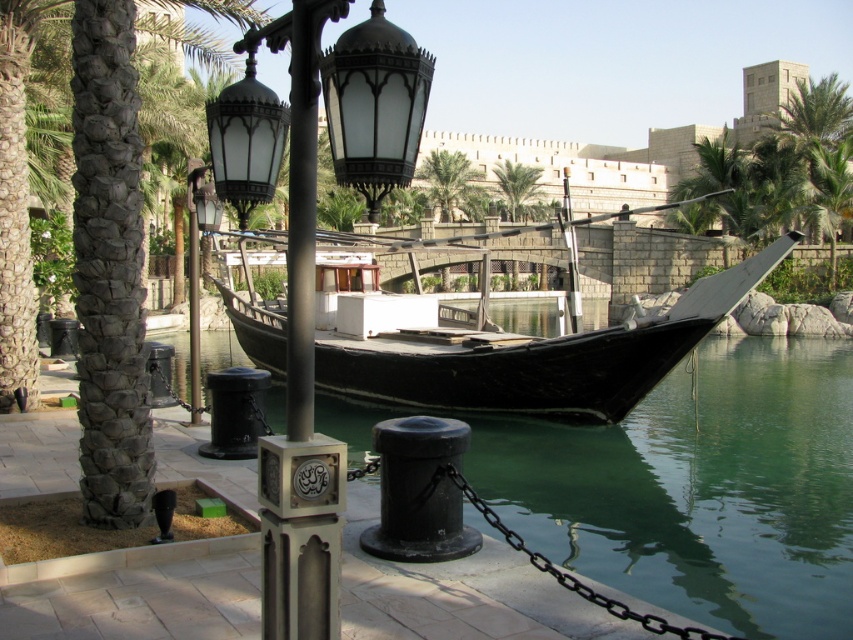
Question: In this image, where is green water at boat right located relative to green leafy palm tree at center?

Choices:
 (A) left
 (B) right

Answer: (A)

Question: Which point is farther to the camera?

Choices:
 (A) green leafy palm tree at upper center
 (B) polished metal street light at center
 (C) green water at boat right
 (D) matte black street light at center

Answer: (A)

Question: Among these objects, which one is farthest from the camera?

Choices:
 (A) green leafy palm tree at upper center
 (B) polished metal street light at center
 (C) green leafy palm tree at center

Answer: (C)

Question: Which point is farther to the camera?

Choices:
 (A) (746, 481)
 (B) (523, 342)
 (C) (192, 260)
 (D) (524, 179)

Answer: (D)

Question: Can you confirm if black polished wood boat at center is positioned above matte black street light at center?

Choices:
 (A) no
 (B) yes

Answer: (A)

Question: In this image, where is green leafy palm tree at upper center located relative to green leafy palm tree at center?

Choices:
 (A) left
 (B) right

Answer: (A)